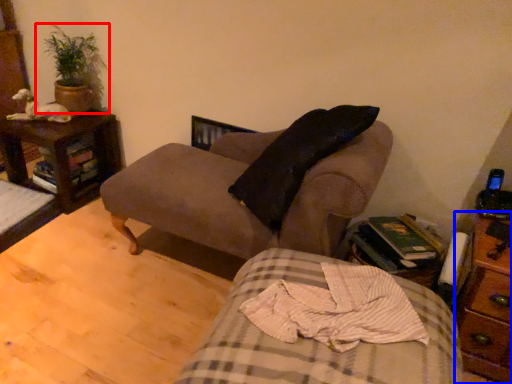
Question: Which object appears closest to the camera in this image, houseplant (highlighted by a red box) or nightstand (highlighted by a blue box)?

Choices:
 (A) houseplant
 (B) nightstand

Answer: (B)